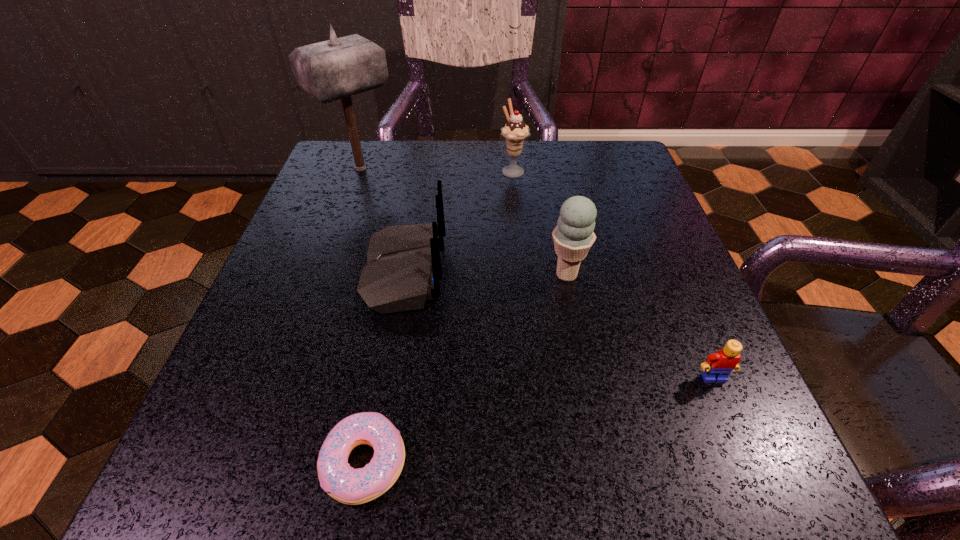
You are a GUI agent. You are given a task and a screenshot of the screen. Output one action in this format:
    pyautogui.click(x=<x>, y=<y>)
    Task: Click on the free spot located on the front of the tallest object
    This screenshot has width=960, height=540.
    Given the screenshot: What is the action you would take?
    pyautogui.click(x=347, y=209)

Identify the location of free space located 0.200m on the front of the fourth object from left to right. The width and height of the screenshot is (960, 540). (519, 238).

The height and width of the screenshot is (540, 960). Find the location of `free space located 0.130m on the back of the nearer ice cream`. free space located 0.130m on the back of the nearer ice cream is located at coordinates (555, 217).

Where is `blank space located 0.060m on the back of the router`? Image resolution: width=960 pixels, height=540 pixels. blank space located 0.060m on the back of the router is located at coordinates (478, 272).

This screenshot has width=960, height=540. In order to click on free space located on the face of the fifth tallest object in this screenshot , I will do `click(747, 455)`.

The height and width of the screenshot is (540, 960). I want to click on vacant region located 0.370m on the back of the shortest object, so click(x=405, y=238).

At what (x,y) coordinates should I click in order to perform the action: click on mallet that is at the far edge. Please return your answer as a coordinate pair (x, y). Looking at the image, I should click on (338, 68).

This screenshot has height=540, width=960. What are the coordinates of `icecream that is positioned at the far edge` in the screenshot? It's located at click(x=515, y=132).

Identify the location of object located at the near edge. This screenshot has width=960, height=540. (345, 484).

Where is `mallet that is at the left edge`? The height and width of the screenshot is (540, 960). mallet that is at the left edge is located at coordinates (338, 68).